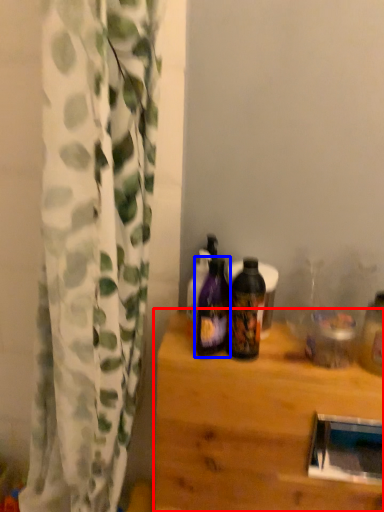
Question: Which object appears farthest to the camera in this image, table (highlighted by a red box) or bottle (highlighted by a blue box)?

Choices:
 (A) table
 (B) bottle

Answer: (A)